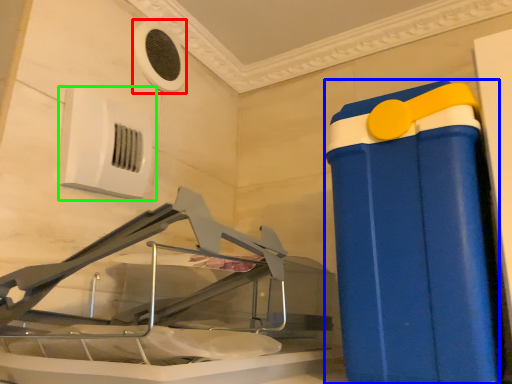
Question: Considering the real-world distances, which object is closest to air conditioning (highlighted by a red box)? waste container (highlighted by a blue box) or air conditioning (highlighted by a green box).

Choices:
 (A) waste container
 (B) air conditioning

Answer: (B)